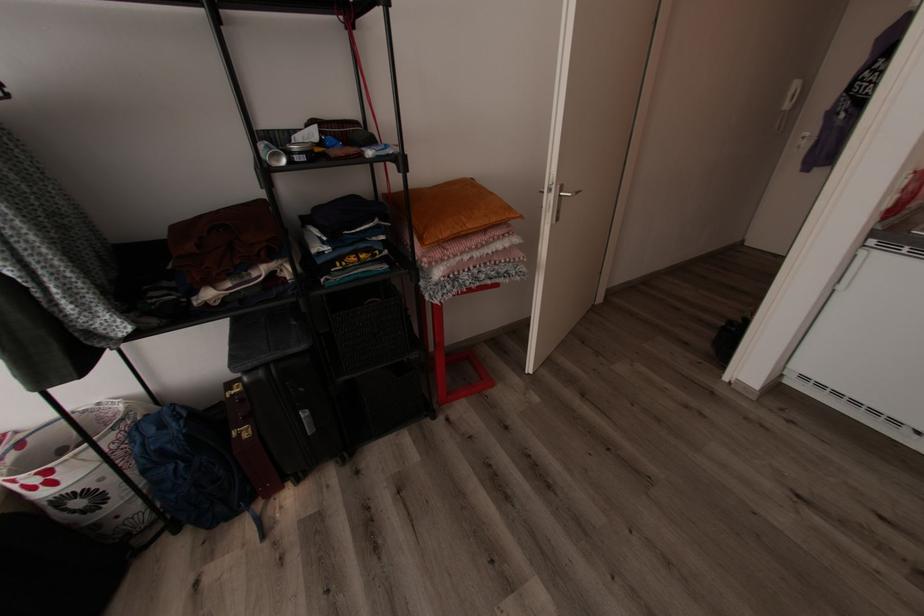
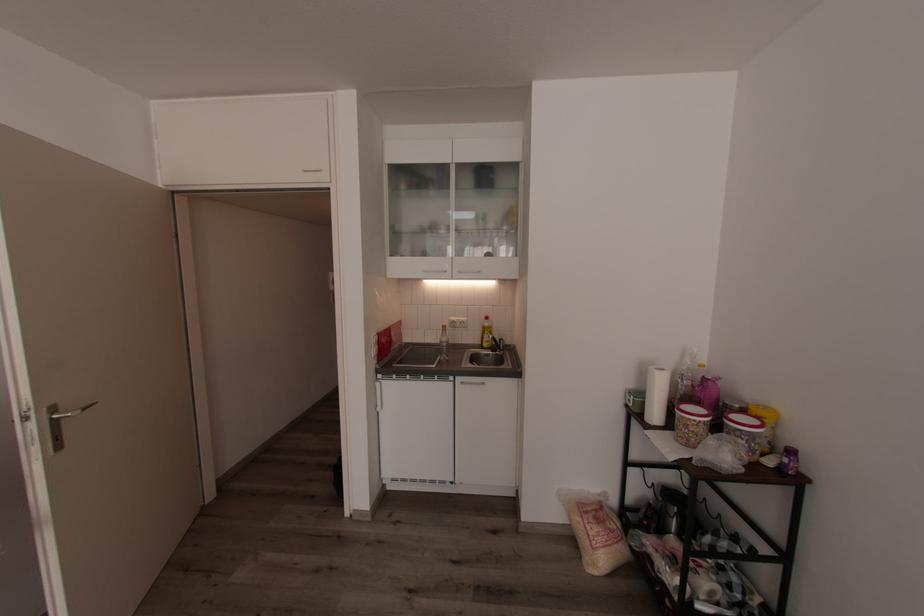
Locate, in the second image, the point that corresponds to (x=581, y=193) in the first image.

(90, 408)